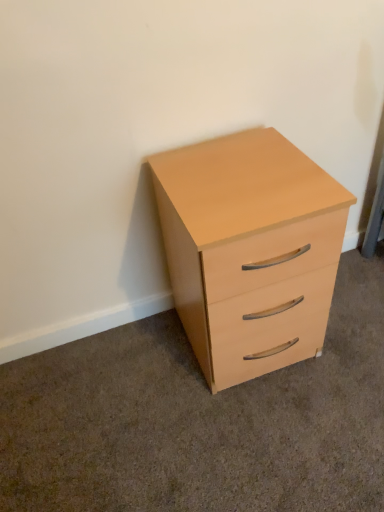
The height and width of the screenshot is (512, 384). I want to click on vacant space situated above light wood/finish chest of drawers at center (from a real-world perspective), so click(x=240, y=162).